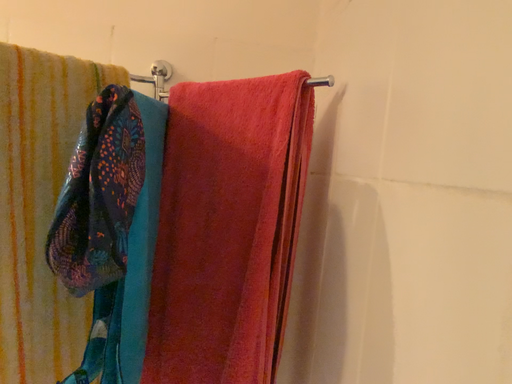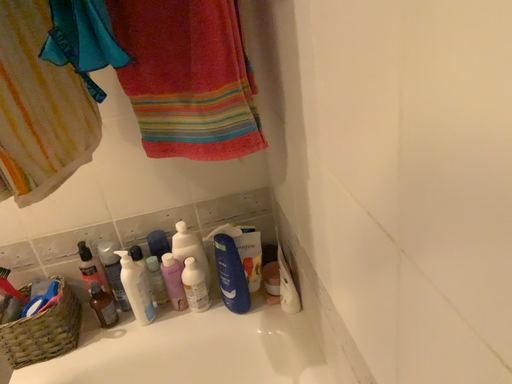
Question: Which way did the camera rotate in the video?

Choices:
 (A) rotated downward
 (B) rotated upward

Answer: (A)